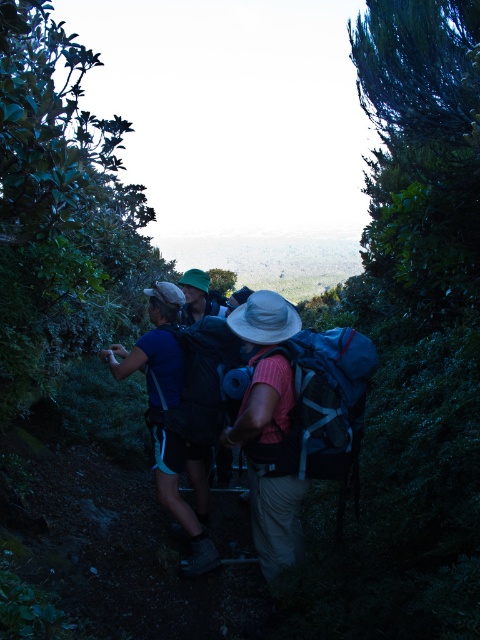
Who is more distant from viewer, [330,381] or [215,392]?

The point [215,392] is more distant.

Looking at this image, does blue fabric backpack at center have a smaller size compared to matte black backpack at center?

No, blue fabric backpack at center is not smaller than matte black backpack at center.

What do you see at coordinates (320, 404) in the screenshot? The image size is (480, 640). I see `blue fabric backpack at center` at bounding box center [320, 404].

Locate an element on the screen. blue fabric backpack at center is located at coordinates (320, 404).

Does point (259, 321) lie behind point (360, 365)?

Yes, it is.

Find the location of a particular element. This screenshot has height=640, width=480. matte black backpacks at center is located at coordinates (276, 522).

Between point (256, 524) and point (347, 440), which one is positioned behind?

The point (256, 524) is more distant.

Locate an element on the screen. The height and width of the screenshot is (640, 480). matte black backpacks at center is located at coordinates (276, 522).

Is matte black backpacks at center smaller than matte black backpack at center?

Incorrect, matte black backpacks at center is not smaller in size than matte black backpack at center.

Which of these two, matte black backpacks at center or matte black backpack at center, stands taller?

Standing taller between the two is matte black backpacks at center.

Is point (255, 369) positioned before point (204, 371)?

Yes, point (255, 369) is closer to viewer.

In order to click on matte black backpacks at center in this screenshot , I will do `click(276, 522)`.